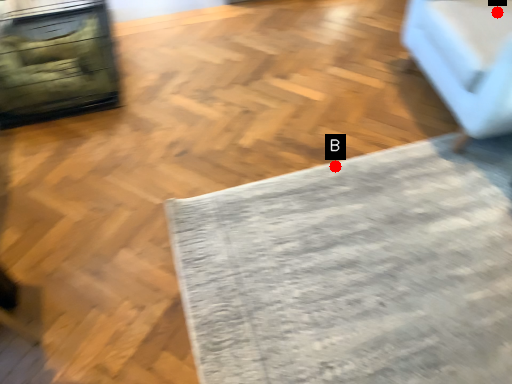
Question: Two points are circled on the image, labeled by A and B beside each circle. Which point is farther to the camera?

Choices:
 (A) A is further
 (B) B is further

Answer: (B)